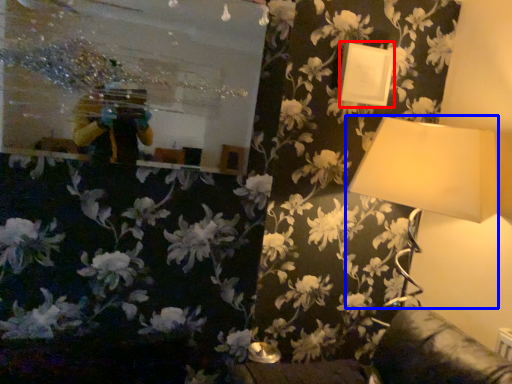
Question: Which object appears closest to the camera in this image, picture frame (highlighted by a red box) or lamp (highlighted by a blue box)?

Choices:
 (A) picture frame
 (B) lamp

Answer: (B)